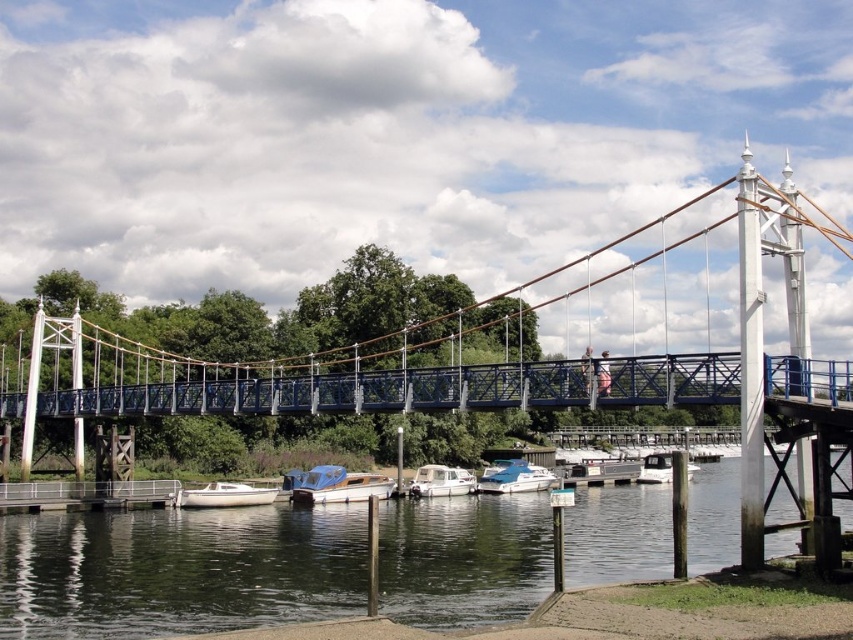
Is greenish water at lower center smaller than blue glossy boat at center?

No.

Which of these two, greenish water at lower center or blue glossy boat at center, stands taller?

greenish water at lower center

Between point (148, 545) and point (544, 477), which one is positioned in front?

Point (148, 545) is in front.

I want to click on greenish water at lower center, so click(x=178, y=570).

Measure the distance between white metal suspension bridge at center and wooden polished boat at center.

white metal suspension bridge at center is 77.89 feet from wooden polished boat at center.

Measure the distance between point (761, 524) and camera.

A distance of 147.66 feet exists between point (761, 524) and camera.

Where is `white metal suspension bridge at center`? white metal suspension bridge at center is located at coordinates [x=491, y=364].

Who is shorter, greenish water at lower center or wooden polished boat at center?

With less height is wooden polished boat at center.

Is greenish water at lower center to the left of wooden polished boat at center from the viewer's perspective?

No, greenish water at lower center is not to the left of wooden polished boat at center.

Which is in front, point (393, 512) or point (358, 476)?

Point (393, 512)

The height and width of the screenshot is (640, 853). Identify the location of greenish water at lower center. (178, 570).